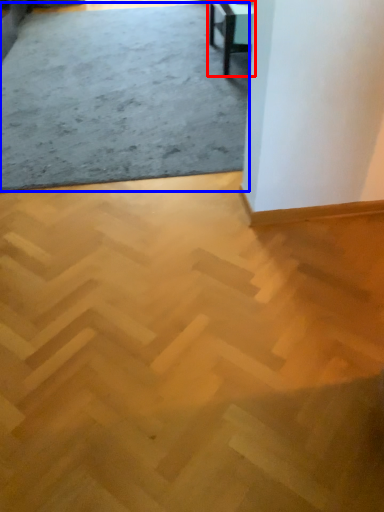
Question: Among these objects, which one is farthest to the camera, table (highlighted by a red box) or concrete (highlighted by a blue box)?

Choices:
 (A) table
 (B) concrete

Answer: (A)